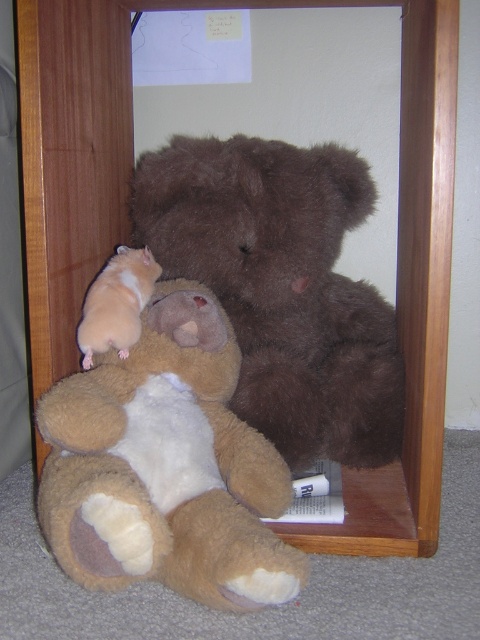
Question: Which object is closer to the camera taking this photo?

Choices:
 (A) light brown plush hamster at lower left
 (B) brown plush teddy bear at center

Answer: (A)

Question: Estimate the real-world distances between objects in this image. Which object is closer to the light brown plush hamster at lower left?

Choices:
 (A) brown plush teddy bear at center
 (B) light brown fur hamster at left

Answer: (B)

Question: Does light brown plush hamster at lower left appear on the right side of brown plush teddy bear at center?

Choices:
 (A) no
 (B) yes

Answer: (A)

Question: Does light brown plush hamster at lower left appear under light brown fur hamster at left?

Choices:
 (A) yes
 (B) no

Answer: (A)

Question: Can you confirm if light brown plush hamster at lower left is positioned to the right of light brown fur hamster at left?

Choices:
 (A) yes
 (B) no

Answer: (A)

Question: Which object is farther from the camera taking this photo?

Choices:
 (A) light brown fur hamster at left
 (B) brown plush teddy bear at center

Answer: (B)